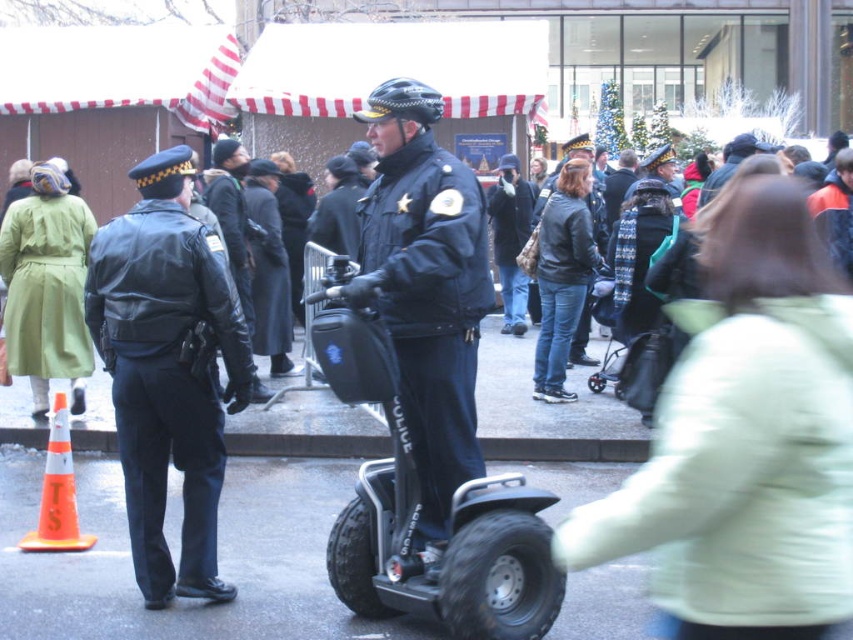
Question: Can you confirm if black leather jacket at left is wider than black rubber scooter at center?

Choices:
 (A) yes
 (B) no

Answer: (B)

Question: Among these objects, which one is nearest to the camera?

Choices:
 (A) black leather jacket at left
 (B) black rubber scooter at center
 (C) orange reflective traffic cone at lower left

Answer: (B)

Question: Does black leather jacket at left lie in front of dark blue leather jacket at center?

Choices:
 (A) yes
 (B) no

Answer: (B)

Question: Which of the following is the closest to the observer?

Choices:
 (A) black leather jacket at left
 (B) orange reflective traffic cone at lower left
 (C) dark blue leather jacket at center
 (D) black rubber scooter at center

Answer: (D)

Question: Is dark blue leather jacket at center smaller than orange reflective traffic cone at lower left?

Choices:
 (A) no
 (B) yes

Answer: (A)

Question: Which point is farther to the camera?

Choices:
 (A) (381, 538)
 (B) (173, 408)

Answer: (B)